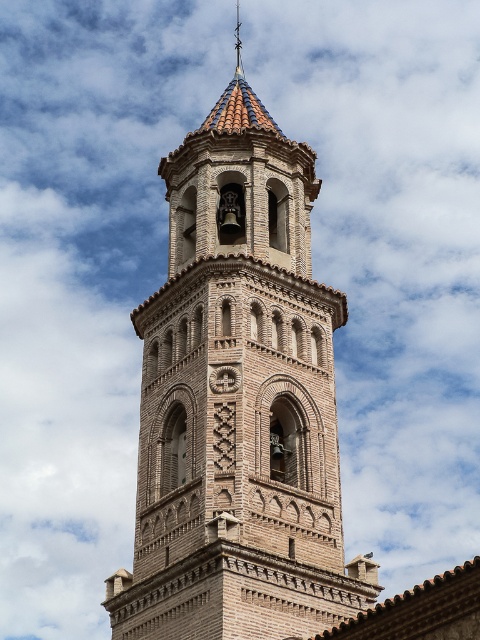
Question: Is brown brick tower at center in front of polished brass cross at upper center?

Choices:
 (A) no
 (B) yes

Answer: (B)

Question: Which of the following is the closest to the observer?

Choices:
 (A) (300, 579)
 (B) (236, 74)

Answer: (A)

Question: Which of the following is the farthest from the observer?

Choices:
 (A) (237, 68)
 (B) (242, 342)

Answer: (A)

Question: Does brown brick tower at center come in front of polished brass cross at upper center?

Choices:
 (A) yes
 (B) no

Answer: (A)

Question: Does brown brick tower at center come behind polished brass cross at upper center?

Choices:
 (A) no
 (B) yes

Answer: (A)

Question: Which of the following is the closest to the observer?

Choices:
 (A) brown brick tower at center
 (B) polished brass cross at upper center

Answer: (A)